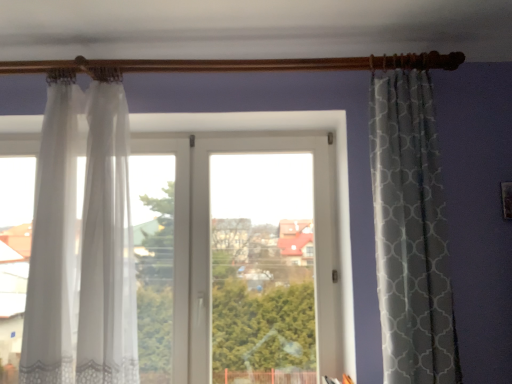
Question: Considering the relative sizes of sheer white curtain at left, the 1th curtain positioned from the left, and white sheer curtain at left, marked as the second curtain in a left-to-right arrangement, in the image provided, is sheer white curtain at left, the 1th curtain positioned from the left, taller than white sheer curtain at left, marked as the second curtain in a left-to-right arrangement,?

Choices:
 (A) yes
 (B) no

Answer: (B)

Question: Is the depth of sheer white curtain at left, positioned as the 2th curtain in right-to-left order, greater than that of white sheer curtain at left, marked as the second curtain in a left-to-right arrangement?

Choices:
 (A) no
 (B) yes

Answer: (A)

Question: Is sheer white curtain at left, positioned as the 2th curtain in right-to-left order, closer to camera compared to white sheer curtain at left, which is counted as the first curtain, starting from the right?

Choices:
 (A) yes
 (B) no

Answer: (A)

Question: Does sheer white curtain at left, positioned as the 2th curtain in right-to-left order, have a greater width compared to white sheer curtain at left, which is counted as the first curtain, starting from the right?

Choices:
 (A) no
 (B) yes

Answer: (A)

Question: Is sheer white curtain at left, the 1th curtain positioned from the left, surrounding white sheer curtain at left, marked as the second curtain in a left-to-right arrangement?

Choices:
 (A) yes
 (B) no

Answer: (B)

Question: Considering the positions of sheer white curtain at left, positioned as the 2th curtain in right-to-left order, and white sheer curtain at left, marked as the second curtain in a left-to-right arrangement, in the image, is sheer white curtain at left, positioned as the 2th curtain in right-to-left order, wider or thinner than white sheer curtain at left, marked as the second curtain in a left-to-right arrangement,?

Choices:
 (A) thin
 (B) wide

Answer: (A)

Question: In terms of height, does sheer white curtain at left, the 1th curtain positioned from the left, look taller or shorter compared to white sheer curtain at left, which is counted as the first curtain, starting from the right?

Choices:
 (A) tall
 (B) short

Answer: (B)

Question: Looking at the image, does sheer white curtain at left, the 1th curtain positioned from the left, seem bigger or smaller compared to white sheer curtain at left, which is counted as the first curtain, starting from the right?

Choices:
 (A) big
 (B) small

Answer: (B)

Question: Is sheer white curtain at left, the 1th curtain positioned from the left, situated inside white sheer curtain at left, marked as the second curtain in a left-to-right arrangement, or outside?

Choices:
 (A) outside
 (B) inside

Answer: (A)

Question: In terms of width, does transparent fabric window at center look wider or thinner when compared to sheer white curtain at left, the 1th curtain positioned from the left?

Choices:
 (A) wide
 (B) thin

Answer: (B)

Question: In terms of height, does transparent fabric window at center look taller or shorter compared to sheer white curtain at left, the 1th curtain positioned from the left?

Choices:
 (A) short
 (B) tall

Answer: (B)

Question: From a real-world perspective, is transparent fabric window at center positioned above or below sheer white curtain at left, positioned as the 2th curtain in right-to-left order?

Choices:
 (A) below
 (B) above

Answer: (A)

Question: Looking at the image, does transparent fabric window at center seem bigger or smaller compared to sheer white curtain at left, positioned as the 2th curtain in right-to-left order?

Choices:
 (A) small
 (B) big

Answer: (B)

Question: In terms of width, does white sheer curtain at left, marked as the second curtain in a left-to-right arrangement, look wider or thinner when compared to sheer white curtain at left, the 1th curtain positioned from the left?

Choices:
 (A) wide
 (B) thin

Answer: (B)

Question: Choose the correct answer: Is white sheer curtain at left, marked as the second curtain in a left-to-right arrangement, inside sheer white curtain at left, positioned as the 2th curtain in right-to-left order, or outside it?

Choices:
 (A) outside
 (B) inside

Answer: (A)